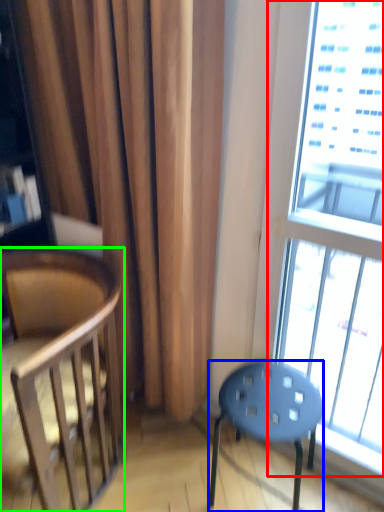
Question: Which object is the closest to the window (highlighted by a red box)? Choose among these: stool (highlighted by a blue box) or chair (highlighted by a green box).

Choices:
 (A) stool
 (B) chair

Answer: (A)